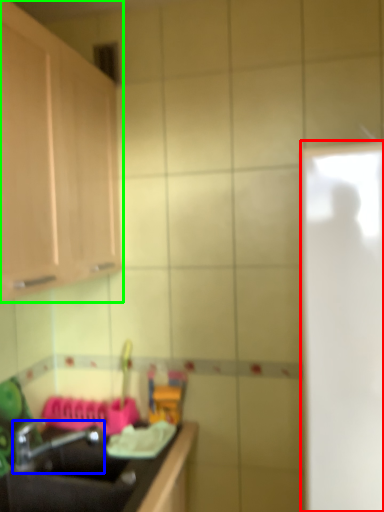
Question: Considering the real-world distances, which object is closest to glass door (highlighted by a red box)? tap (highlighted by a blue box) or cabinetry (highlighted by a green box).

Choices:
 (A) tap
 (B) cabinetry

Answer: (B)